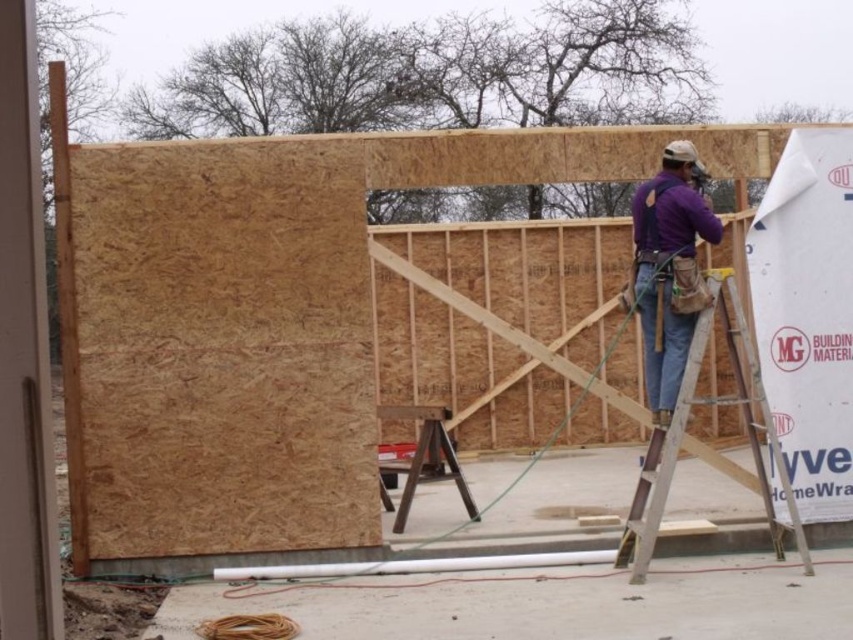
You are a construction inspector reviewing the site. The point at coordinates (669, 268) is marked on your blueprint. Which object is this point located on?

The point at coordinates (669, 268) is located on the purple cotton shirt at center.